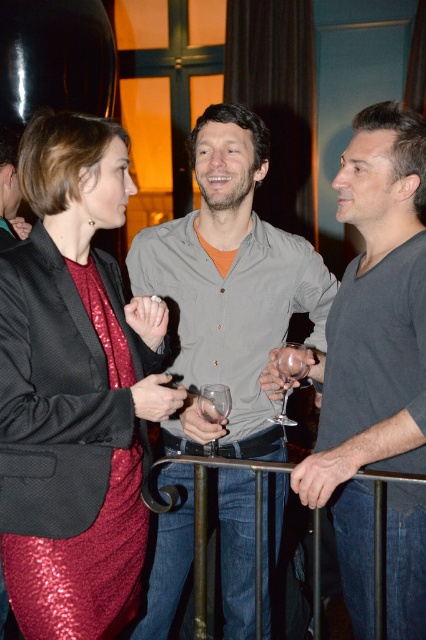
You are at a party and need to grab a drink. You see the gray matte shirt at center and the transparent glass wine glass at center. Which one is closer to the ceiling?

The gray matte shirt at center is above the transparent glass wine glass at center, so it is closer to the ceiling.